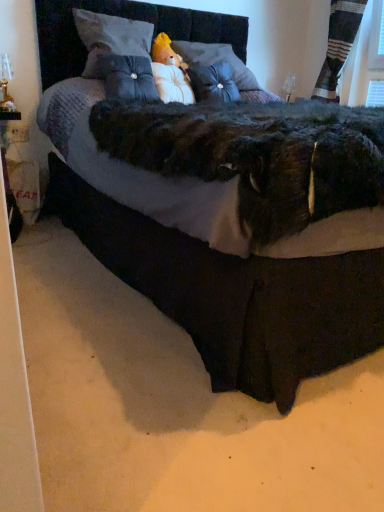
Find the location of a particular element. This screenshot has height=512, width=384. velvet gray pillow at upper center, placed as the 4th pillow when sorted from right to left is located at coordinates (111, 38).

I want to click on white plush at center, the second pillow positioned from the right, so click(172, 84).

This screenshot has height=512, width=384. Identify the location of satin blue pillow at center, marked as the first pillow in a right-to-left arrangement. (213, 83).

How much space does satin blue pillow at center, which is counted as the fourth pillow, starting from the left, occupy horizontally?

It is 8.58 inches.

Locate an element on the screen. Image resolution: width=384 pixels, height=512 pixels. velvet black bed at center is located at coordinates (239, 298).

This screenshot has width=384, height=512. What do you see at coordinates (21, 168) in the screenshot?
I see `white plush doll at lower left` at bounding box center [21, 168].

This screenshot has height=512, width=384. I want to click on suede-like blue pillow at center, which is counted as the third pillow, starting from the right, so click(x=126, y=76).

From the image's perspective, is white plush at center, which is the third pillow in left-to-right order, below white plush doll at lower left?

No, from the image's perspective, white plush at center, which is the third pillow in left-to-right order, is not beneath white plush doll at lower left.

From the picture: Does white plush at center, the second pillow positioned from the right, have a lesser height compared to white plush doll at lower left?

Indeed, white plush at center, the second pillow positioned from the right, has a lesser height compared to white plush doll at lower left.

Can you confirm if white plush at center, which is the third pillow in left-to-right order, is positioned to the right of white plush doll at lower left?

Yes.

Can you confirm if white plush at center, which is the third pillow in left-to-right order, is smaller than suede-like blue pillow at center, which is counted as the third pillow, starting from the right?

Indeed, white plush at center, which is the third pillow in left-to-right order, has a smaller size compared to suede-like blue pillow at center, which is counted as the third pillow, starting from the right.

Is white plush at center, which is the third pillow in left-to-right order, facing away from suede-like blue pillow at center, which is counted as the third pillow, starting from the right?

No, white plush at center, which is the third pillow in left-to-right order, is not facing away from suede-like blue pillow at center, which is counted as the third pillow, starting from the right.

Considering the positions of point (173, 98) and point (151, 68), is point (173, 98) closer or farther from the camera than point (151, 68)?

Point (173, 98) is positioned closer to the camera compared to point (151, 68).

From the image's perspective, is white plush at center, the second pillow positioned from the right, on suede-like blue pillow at center, which is counted as the third pillow, starting from the right?

Yes.

Consider the image. Is suede-like blue pillow at center, which is counted as the third pillow, starting from the right, not near white plush doll at lower left?

No, there isn't a large distance between suede-like blue pillow at center, which is counted as the third pillow, starting from the right, and white plush doll at lower left.

How different are the orientations of suede-like blue pillow at center, which is counted as the third pillow, starting from the right, and white plush doll at lower left in degrees?

They differ by 1.87 degrees in their facing directions.

Between suede-like blue pillow at center, the second pillow when ordered from left to right, and white plush doll at lower left, which one has less height?

Standing shorter between the two is suede-like blue pillow at center, the second pillow when ordered from left to right.

Which is in front, point (110, 97) or point (16, 162)?

The point (110, 97) is more forward.

How many degrees apart are the facing directions of white plush at center, which is the third pillow in left-to-right order, and striped fabric curtain at upper right?

The angular difference between white plush at center, which is the third pillow in left-to-right order, and striped fabric curtain at upper right is 97.5 degrees.

Between white plush at center, the second pillow positioned from the right, and striped fabric curtain at upper right, which one is positioned in front?

white plush at center, the second pillow positioned from the right.

Between white plush at center, which is the third pillow in left-to-right order, and striped fabric curtain at upper right, which one has larger width?

striped fabric curtain at upper right is wider.

Between white plush at center, which is the third pillow in left-to-right order, and velvet gray pillow at upper center, placed as the 4th pillow when sorted from right to left, which one has larger size?

velvet gray pillow at upper center, placed as the 4th pillow when sorted from right to left, is bigger.

How much distance is there between white plush at center, the second pillow positioned from the right, and velvet gray pillow at upper center, placed as the 4th pillow when sorted from right to left?

white plush at center, the second pillow positioned from the right, and velvet gray pillow at upper center, placed as the 4th pillow when sorted from right to left, are 25.56 centimeters apart.

From the image's perspective, would you say white plush at center, the second pillow positioned from the right, is shown under velvet gray pillow at upper center, which is the first pillow from left to right?

Correct, white plush at center, the second pillow positioned from the right, appears lower than velvet gray pillow at upper center, which is the first pillow from left to right, in the image.

Does velvet black bed at center have a lesser width compared to white plush doll at lower left?

No.

Considering the points (186, 33) and (11, 150), which point is in front, point (186, 33) or point (11, 150)?

Positioned in front is point (11, 150).

Who is taller, velvet black bed at center or white plush doll at lower left?

With more height is velvet black bed at center.

Does satin blue pillow at center, marked as the first pillow in a right-to-left arrangement, have a lesser width compared to velvet black bed at center?

Yes, satin blue pillow at center, marked as the first pillow in a right-to-left arrangement, is thinner than velvet black bed at center.

Can you confirm if satin blue pillow at center, marked as the first pillow in a right-to-left arrangement, is smaller than velvet black bed at center?

Yes, satin blue pillow at center, marked as the first pillow in a right-to-left arrangement, is smaller than velvet black bed at center.

From a real-world perspective, which object stands above the other?

satin blue pillow at center, marked as the first pillow in a right-to-left arrangement, from a real-world perspective.

How different are the orientations of satin blue pillow at center, marked as the first pillow in a right-to-left arrangement, and velvet black bed at center in degrees?

The angular difference between satin blue pillow at center, marked as the first pillow in a right-to-left arrangement, and velvet black bed at center is 7.01 degrees.

I want to click on the 1st pillow in front of the white plush doll at lower left, so click(172, 84).

Locate an element on the screen. the 1st pillow above the suede-like blue pillow at center, the second pillow when ordered from left to right (from the image's perspective) is located at coordinates (172, 84).

Consider the image. When comparing their distances from satin blue pillow at center, marked as the first pillow in a right-to-left arrangement, does white plush at center, the second pillow positioned from the right, or white plush doll at lower left seem further?

→ white plush doll at lower left is further to satin blue pillow at center, marked as the first pillow in a right-to-left arrangement.

In the scene shown: Which object lies further to the anchor point velvet gray pillow at upper center, which is the first pillow from left to right, satin blue pillow at center, which is counted as the fourth pillow, starting from the left, or velvet black bed at center?

The object further to velvet gray pillow at upper center, which is the first pillow from left to right, is velvet black bed at center.

Looking at the image, which one is located further to white plush doll at lower left, velvet gray pillow at upper center, placed as the 4th pillow when sorted from right to left, or satin blue pillow at center, which is counted as the fourth pillow, starting from the left?

satin blue pillow at center, which is counted as the fourth pillow, starting from the left.

When comparing their distances from velvet black bed at center, does satin blue pillow at center, which is counted as the fourth pillow, starting from the left, or suede-like blue pillow at center, the second pillow when ordered from left to right, seem closer?

The object closer to velvet black bed at center is suede-like blue pillow at center, the second pillow when ordered from left to right.

Based on their spatial positions, is satin blue pillow at center, which is counted as the fourth pillow, starting from the left, or velvet gray pillow at upper center, placed as the 4th pillow when sorted from right to left, closer to striped fabric curtain at upper right?

satin blue pillow at center, which is counted as the fourth pillow, starting from the left.

When comparing their distances from velvet black bed at center, does striped fabric curtain at upper right or velvet gray pillow at upper center, placed as the 4th pillow when sorted from right to left, seem closer?

Based on the image, velvet gray pillow at upper center, placed as the 4th pillow when sorted from right to left, appears to be nearer to velvet black bed at center.

Which object lies nearer to the anchor point velvet black bed at center, satin blue pillow at center, marked as the first pillow in a right-to-left arrangement, or velvet gray pillow at upper center, which is the first pillow from left to right?

Among the two, velvet gray pillow at upper center, which is the first pillow from left to right, is located nearer to velvet black bed at center.

Consider the image. When comparing their distances from striped fabric curtain at upper right, does suede-like blue pillow at center, the second pillow when ordered from left to right, or satin blue pillow at center, which is counted as the fourth pillow, starting from the left, seem closer?

Based on the image, satin blue pillow at center, which is counted as the fourth pillow, starting from the left, appears to be nearer to striped fabric curtain at upper right.

In order to click on pillow situated between white plush at center, the second pillow positioned from the right, and striped fabric curtain at upper right from left to right in this screenshot , I will do `click(213, 83)`.

The image size is (384, 512). What are the coordinates of `pillow located between velvet black bed at center and velvet gray pillow at upper center, placed as the 4th pillow when sorted from right to left, in the depth direction` in the screenshot? It's located at (126, 76).

Locate an element on the screen. The image size is (384, 512). doll between velvet black bed at center and satin blue pillow at center, which is counted as the fourth pillow, starting from the left, in the front-back direction is located at coordinates (21, 168).

At what (x,y) coordinates should I click in order to perform the action: click on doll between velvet black bed at center and striped fabric curtain at upper right in the front-back direction. Please return your answer as a coordinate pair (x, y). The height and width of the screenshot is (512, 384). Looking at the image, I should click on (21, 168).